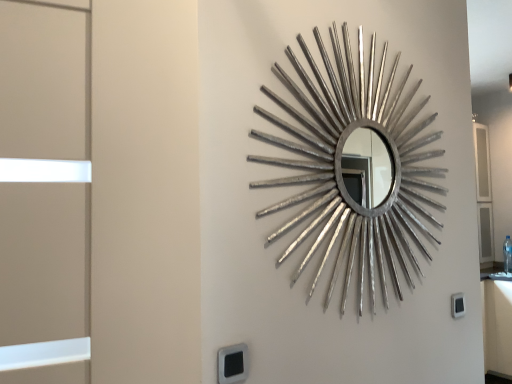
Question: Is black plastic electric outlet at lower right, which is the 2th electric outlet from left to right, outside silver metallic mirror at center?

Choices:
 (A) no
 (B) yes

Answer: (B)

Question: Is black plastic electric outlet at lower right, arranged as the 2th electric outlet when viewed from the front, facing towards silver metallic mirror at center?

Choices:
 (A) no
 (B) yes

Answer: (A)

Question: Is black plastic electric outlet at lower right, the 1th electric outlet from the back, positioned in front of silver metallic mirror at center?

Choices:
 (A) yes
 (B) no

Answer: (B)

Question: Is black plastic electric outlet at lower right, which appears as the 1th electric outlet when viewed from the right, far away from silver metallic mirror at center?

Choices:
 (A) yes
 (B) no

Answer: (B)

Question: Is black plastic electric outlet at lower right, the 1th electric outlet from the back, at the right side of silver metallic mirror at center?

Choices:
 (A) yes
 (B) no

Answer: (A)

Question: From the image's perspective, relative to black plastic electric outlet at lower center, the second electric outlet in the back-to-front sequence, is silver metallic mirror at center above or below?

Choices:
 (A) above
 (B) below

Answer: (A)

Question: Would you say silver metallic mirror at center is to the left or to the right of black plastic electric outlet at lower center, the second electric outlet in the back-to-front sequence, in the picture?

Choices:
 (A) right
 (B) left

Answer: (A)

Question: In terms of height, does silver metallic mirror at center look taller or shorter compared to black plastic electric outlet at lower center, the second electric outlet in the back-to-front sequence?

Choices:
 (A) tall
 (B) short

Answer: (A)

Question: From a real-world perspective, is silver metallic mirror at center positioned above or below black plastic electric outlet at lower center, the first electric outlet when ordered from left to right?

Choices:
 (A) below
 (B) above

Answer: (B)

Question: Is black plastic electric outlet at lower right, the 1th electric outlet from the back, inside the boundaries of silver metallic mirror at center, or outside?

Choices:
 (A) outside
 (B) inside

Answer: (A)

Question: From their relative heights in the image, would you say black plastic electric outlet at lower right, which appears as the 1th electric outlet when viewed from the right, is taller or shorter than silver metallic mirror at center?

Choices:
 (A) short
 (B) tall

Answer: (A)

Question: Is black plastic electric outlet at lower right, arranged as the 2th electric outlet when viewed from the front, to the left or to the right of silver metallic mirror at center in the image?

Choices:
 (A) left
 (B) right

Answer: (B)

Question: In terms of size, does black plastic electric outlet at lower right, arranged as the 2th electric outlet when viewed from the front, appear bigger or smaller than silver metallic mirror at center?

Choices:
 (A) small
 (B) big

Answer: (A)

Question: Considering the positions of black plastic electric outlet at lower center, which ranks as the 2th electric outlet in right-to-left order, and black plastic electric outlet at lower right, which is the 2th electric outlet from left to right, in the image, is black plastic electric outlet at lower center, which ranks as the 2th electric outlet in right-to-left order, wider or thinner than black plastic electric outlet at lower right, which is the 2th electric outlet from left to right,?

Choices:
 (A) thin
 (B) wide

Answer: (B)

Question: Visually, is black plastic electric outlet at lower center, the second electric outlet in the back-to-front sequence, positioned to the left or to the right of black plastic electric outlet at lower right, arranged as the 2th electric outlet when viewed from the front?

Choices:
 (A) left
 (B) right

Answer: (A)